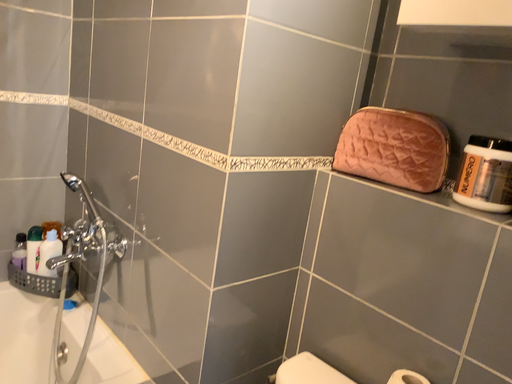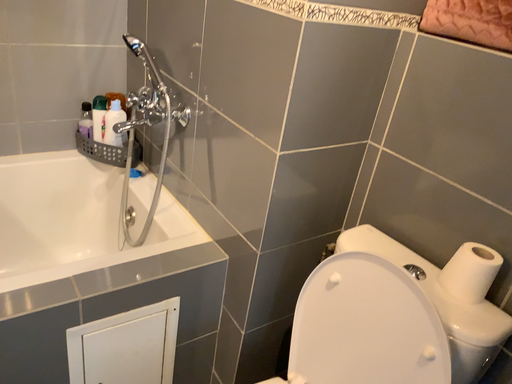
Question: How did the camera likely rotate when shooting the video?

Choices:
 (A) rotated right
 (B) rotated left

Answer: (B)